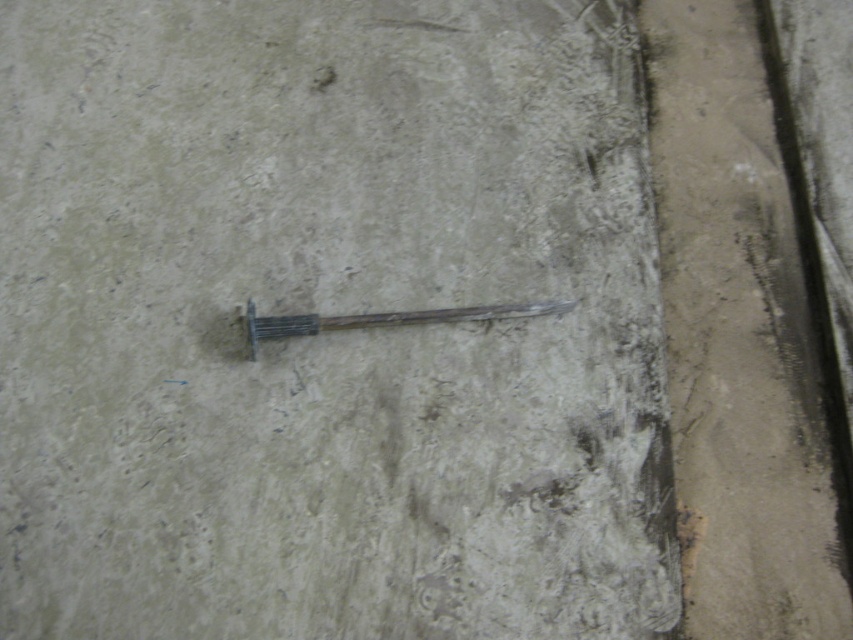
Question: Can you confirm if smooth concrete at right is positioned below wooden stick at center?

Choices:
 (A) no
 (B) yes

Answer: (A)

Question: Does smooth concrete at right lie in front of wooden stick at center?

Choices:
 (A) yes
 (B) no

Answer: (A)

Question: Among these points, which one is farthest from the camera?

Choices:
 (A) (384, 323)
 (B) (756, 109)

Answer: (B)

Question: Is smooth concrete at right below wooden stick at center?

Choices:
 (A) yes
 (B) no

Answer: (B)

Question: Which point is farther to the camera?

Choices:
 (A) (733, 426)
 (B) (511, 307)

Answer: (B)